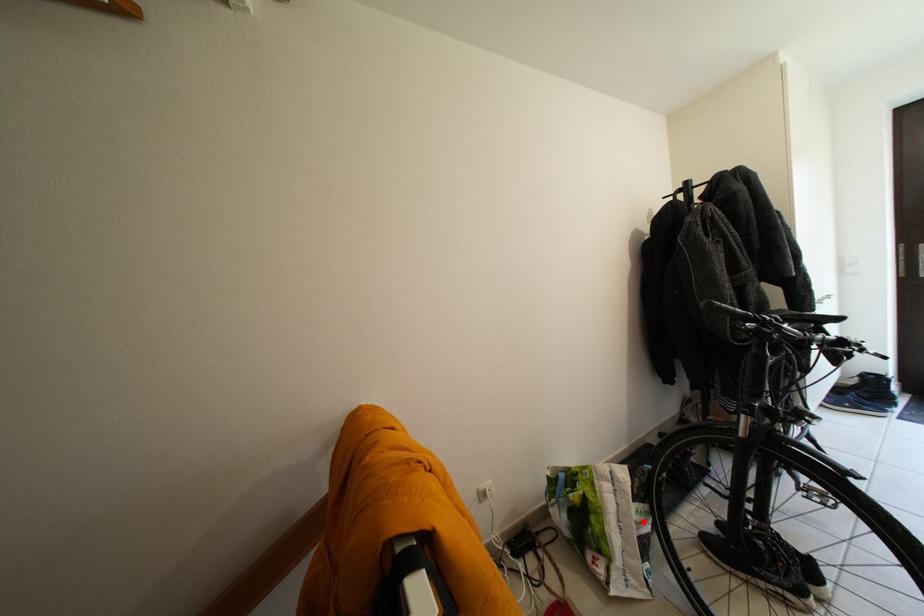
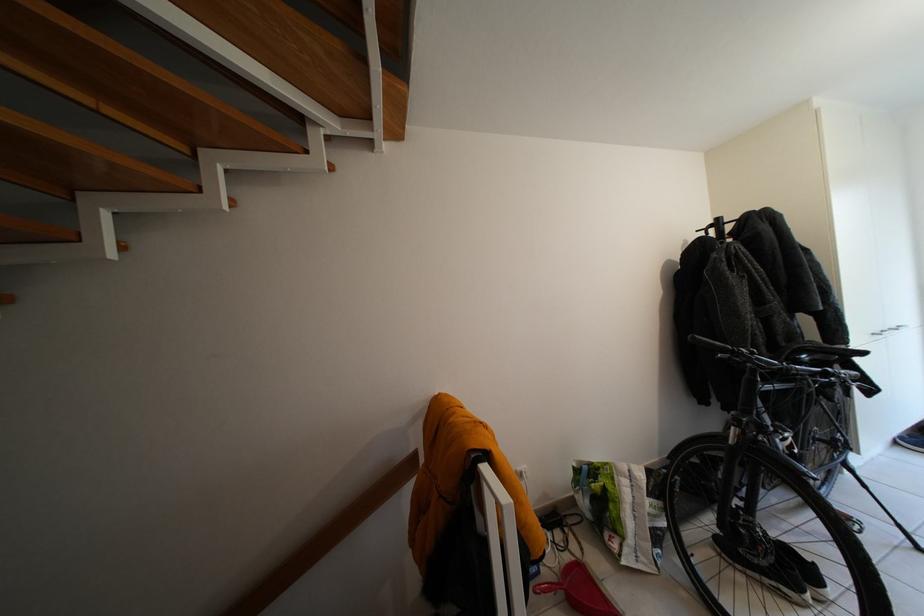
Locate, in the second image, the point that corresponds to the highlighted location in the first image.

(657, 515)